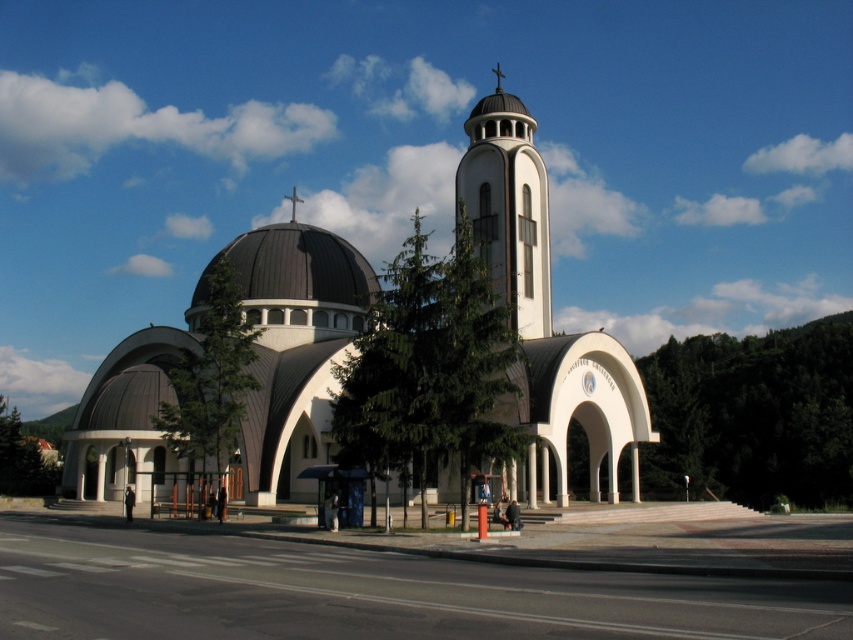
Question: Is the position of white smooth church at center more distant than that of white smooth spire at center?

Choices:
 (A) no
 (B) yes

Answer: (A)

Question: Among these points, which one is nearest to the camera?

Choices:
 (A) pyautogui.click(x=258, y=273)
 (B) pyautogui.click(x=543, y=225)
 (C) pyautogui.click(x=299, y=262)

Answer: (B)

Question: Which of the following is the closest to the observer?

Choices:
 (A) (265, 339)
 (B) (308, 269)
 (C) (541, 275)

Answer: (A)

Question: Considering the real-world distances, which object is closest to the black dome at center?

Choices:
 (A) white smooth spire at center
 (B) white smooth church at center

Answer: (B)

Question: Where is white smooth church at center located in relation to white smooth spire at center in the image?

Choices:
 (A) left
 (B) right

Answer: (A)

Question: Does white smooth spire at center have a lesser width compared to black dome at center?

Choices:
 (A) no
 (B) yes

Answer: (B)